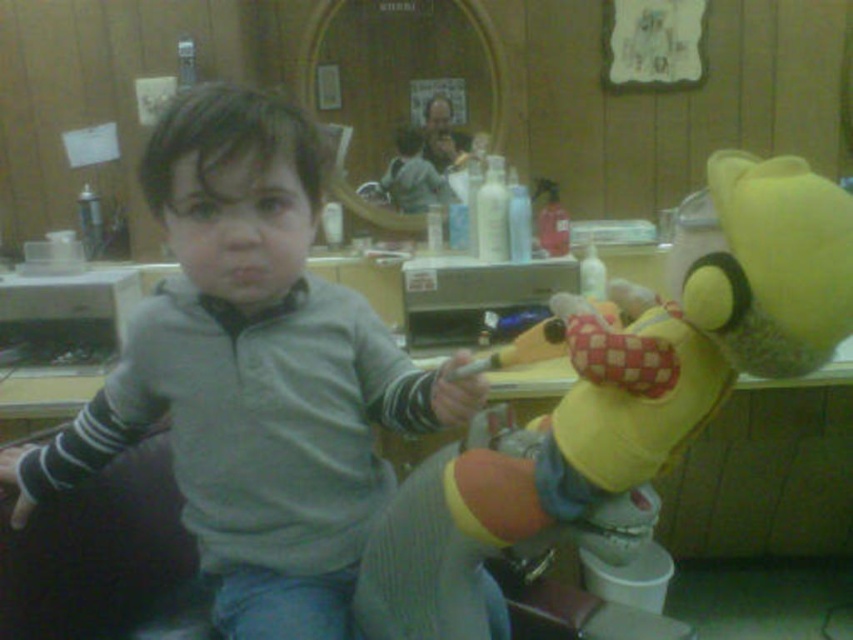
You are a parent trying to cheer up your child who is sitting on a barber chair in a barbershop. You see a yellow plush toy at center and a smooth plastic comb at upper center. Which object is taller?

The yellow plush toy at center is taller than the smooth plastic comb at upper center.

You are standing at the entrance of the barbershop and want to move towards the child sitting in the barber chair. There are two points marked in the image. The first point is at coordinate point [682,362] and the second is at point [445,164]. Which point should you aim for to reach the child more directly?

Point [682,362] is in front of point [445,164], so you should aim for point [682,362] to reach the child more directly.

You are a parent trying to cheer up your child who is sitting on the barber chair in the barbershop. You see a yellow plush toy at center and a smooth plastic comb at upper center. Which object is closer to the child?

The yellow plush toy at center is closer to the child because it is positioned under the smooth plastic comb at upper center, meaning it is lower and nearer in the scene.